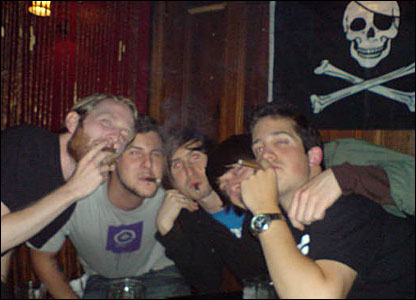
This screenshot has height=300, width=416. I want to click on wooden wall, so click(258, 85).